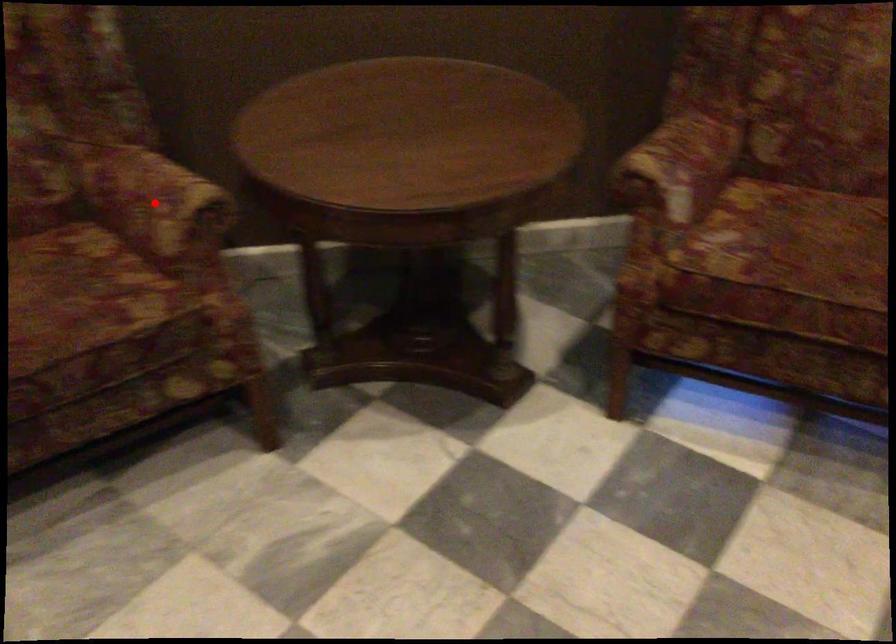
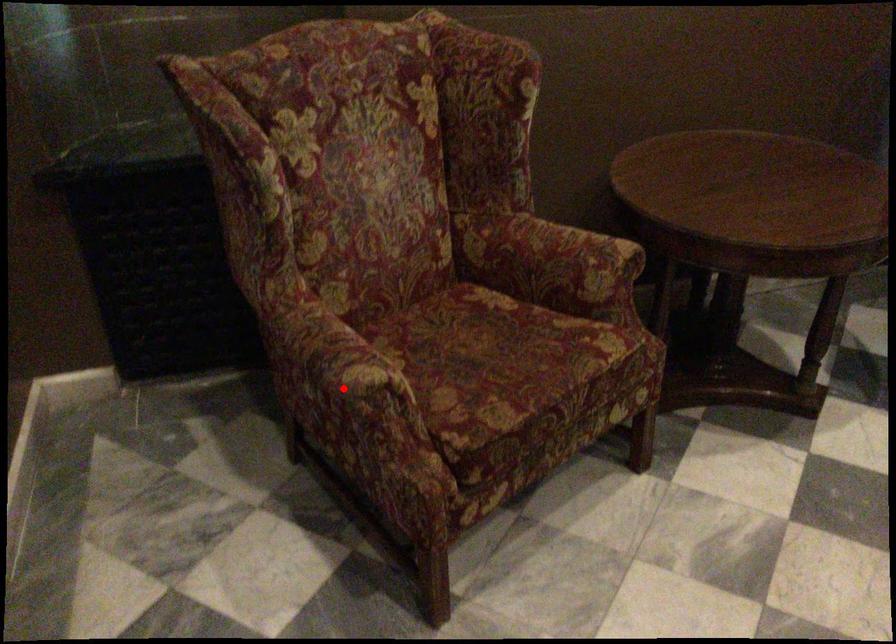
I am providing you with two images of the same scene from different viewpoints. A red point is marked on the first image and another point is marked on the second image. Is the red point in image1 aligned with the point shown in image2?

No